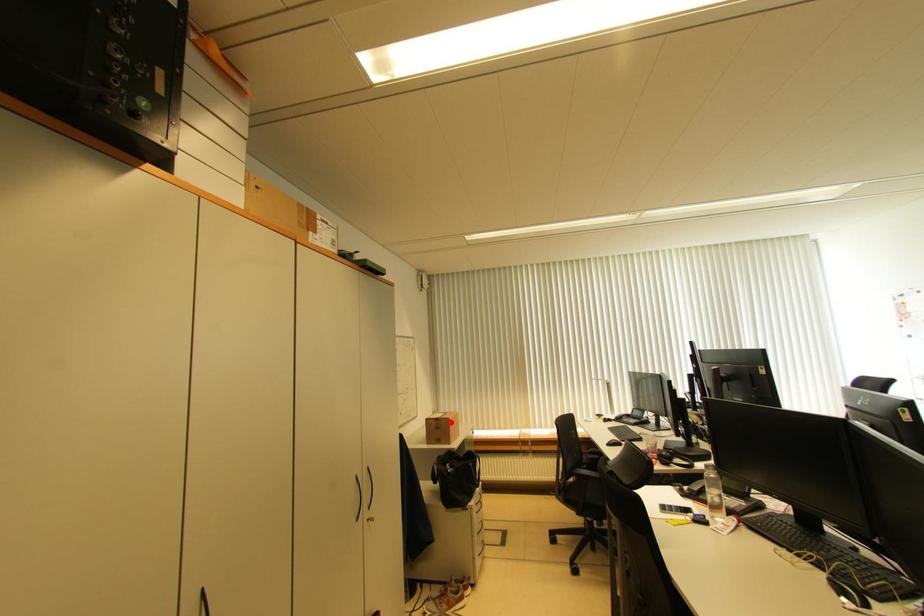
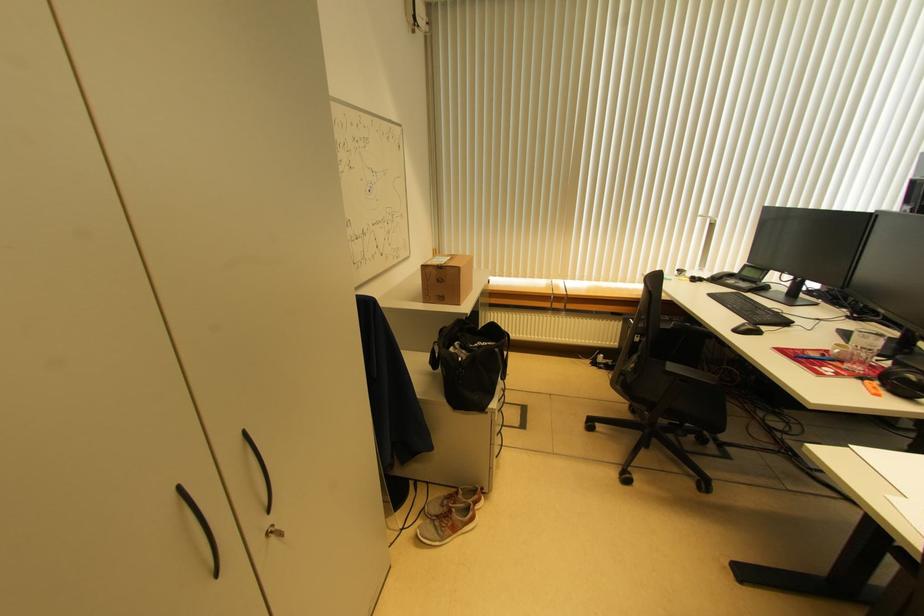
Locate, in the second image, the point that corresponds to the highlighted location in the first image.

(459, 272)